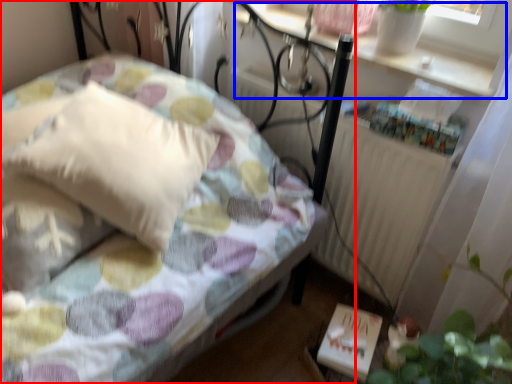
Question: Which of the following is the closest to the observer, bed (highlighted by a red box) or window sill (highlighted by a blue box)?

Choices:
 (A) bed
 (B) window sill

Answer: (A)